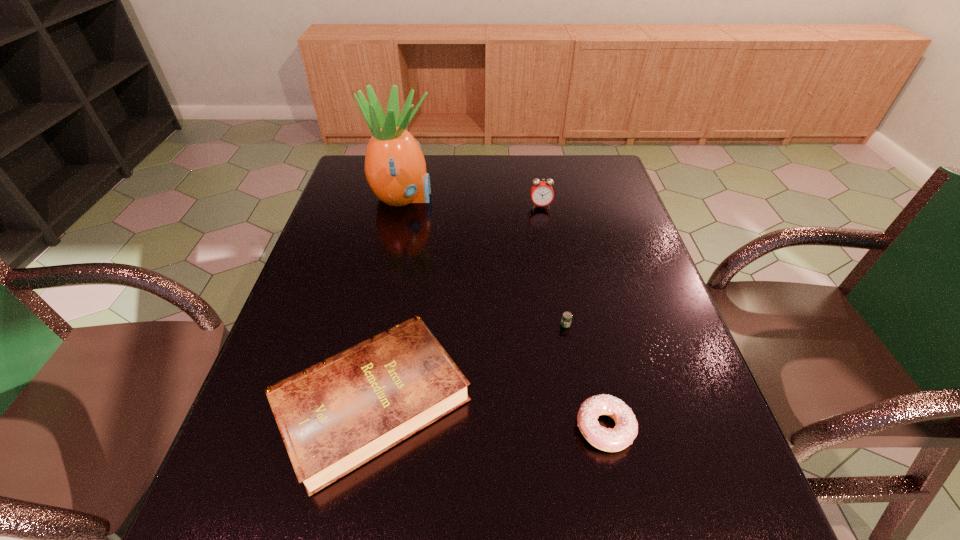
What are the coordinates of `pineapple` in the screenshot? It's located at (395, 167).

Find the location of a particular element. The height and width of the screenshot is (540, 960). the second tallest object is located at coordinates (542, 193).

Locate an element on the screen. The width and height of the screenshot is (960, 540). hardback book is located at coordinates (336, 415).

I want to click on the second shortest object, so click(x=622, y=435).

Locate an element on the screen. This screenshot has height=540, width=960. beer can is located at coordinates (566, 320).

Identify the location of vacant region located at the entrance of the tallest object. (483, 198).

This screenshot has width=960, height=540. In order to click on vacant region located 0.090m on the front-facing side of the fourth shortest object in this screenshot , I will do `click(544, 228)`.

The image size is (960, 540). Identify the location of blank space located on the right of the third tallest object. (596, 401).

Where is `blank space located 0.170m on the back of the second shortest object`? The height and width of the screenshot is (540, 960). blank space located 0.170m on the back of the second shortest object is located at coordinates click(585, 335).

Find the location of a particular element. Image resolution: width=960 pixels, height=540 pixels. blank area located 0.380m on the front of the shortest object is located at coordinates pyautogui.click(x=600, y=516).